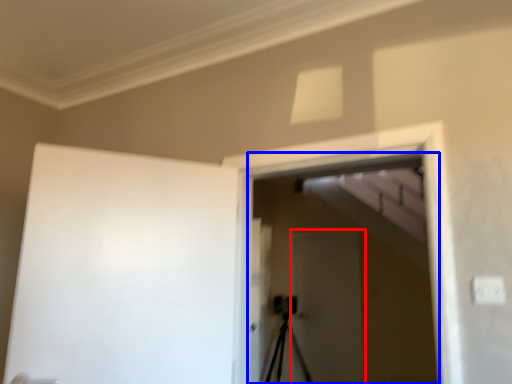
Question: Which of the following is the closest to the observer, screen door (highlighted by a red box) or screen door (highlighted by a blue box)?

Choices:
 (A) screen door
 (B) screen door

Answer: (B)